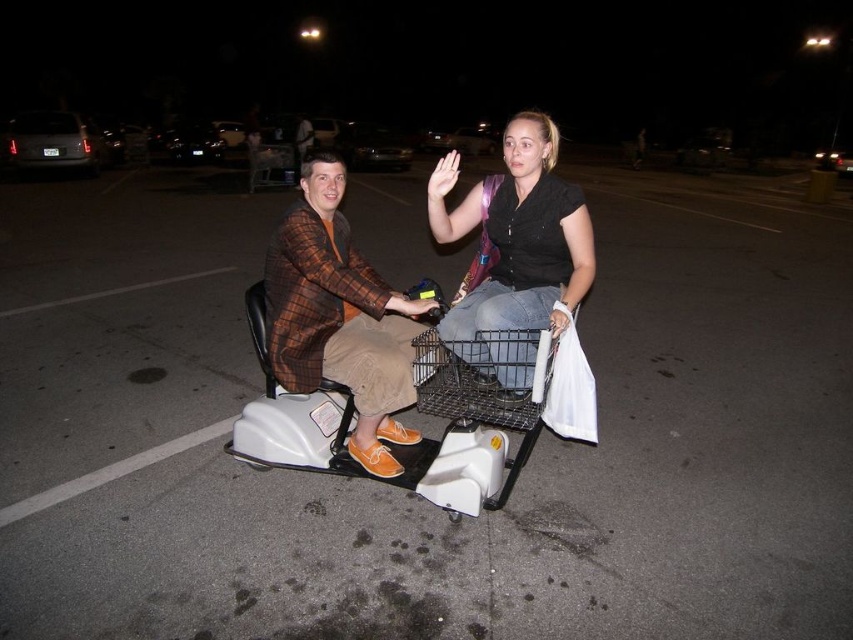
Question: Does matte black scooter at center have a smaller size compared to matte black shirt at center?

Choices:
 (A) no
 (B) yes

Answer: (A)

Question: Which is nearer to the matte black shirt at center?

Choices:
 (A) brown plaid jacket at center
 (B) matte black scooter at center

Answer: (B)

Question: Does matte black scooter at center have a smaller size compared to brown plaid jacket at center?

Choices:
 (A) no
 (B) yes

Answer: (A)

Question: Which point appears closest to the camera in this image?

Choices:
 (A) (556, 234)
 (B) (326, 273)
 (C) (538, 294)

Answer: (B)

Question: Which of the following is the closest to the observer?

Choices:
 (A) matte black scooter at center
 (B) brown plaid jacket at center
 (C) matte black shirt at center

Answer: (A)

Question: Does brown plaid jacket at center have a lesser width compared to matte black shirt at center?

Choices:
 (A) yes
 (B) no

Answer: (A)